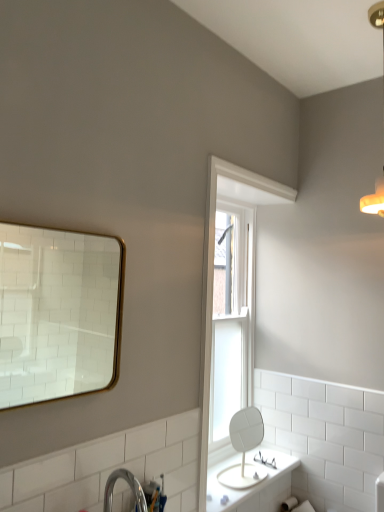
Question: Does white painted wood window frame at upper center lie behind gold-framed mirror at upper left, arranged as the 2th mirror when viewed from the right?

Choices:
 (A) yes
 (B) no

Answer: (A)

Question: From a real-world perspective, is white painted wood window frame at upper center physically above gold-framed mirror at upper left, the first mirror from the top?

Choices:
 (A) yes
 (B) no

Answer: (B)

Question: Considering the relative sizes of white painted wood window frame at upper center and gold-framed mirror at upper left, the 2th mirror positioned from the back, in the image provided, is white painted wood window frame at upper center bigger than gold-framed mirror at upper left, the 2th mirror positioned from the back,?

Choices:
 (A) no
 (B) yes

Answer: (B)

Question: From the image's perspective, does white painted wood window frame at upper center appear lower than gold-framed mirror at upper left, the first mirror from the top?

Choices:
 (A) yes
 (B) no

Answer: (A)

Question: Is white painted wood window frame at upper center not inside gold-framed mirror at upper left, the first mirror from the top?

Choices:
 (A) no
 (B) yes

Answer: (B)

Question: Does white painted wood window frame at upper center contain gold-framed mirror at upper left, the 2th mirror positioned from the back?

Choices:
 (A) yes
 (B) no

Answer: (B)

Question: From a real-world perspective, is white glossy mirror at center, the 1th mirror when ordered from back to front, beneath warm matte light fixture at upper right?

Choices:
 (A) no
 (B) yes

Answer: (B)

Question: Is white glossy mirror at center, the 2th mirror from the front, oriented away from warm matte light fixture at upper right?

Choices:
 (A) no
 (B) yes

Answer: (A)

Question: From the image's perspective, is white glossy mirror at center, acting as the first mirror starting from the right, above warm matte light fixture at upper right?

Choices:
 (A) yes
 (B) no

Answer: (B)

Question: Considering the relative positions of white glossy mirror at center, placed as the 1th mirror when sorted from bottom to top, and warm matte light fixture at upper right in the image provided, is white glossy mirror at center, placed as the 1th mirror when sorted from bottom to top, to the left of warm matte light fixture at upper right from the viewer's perspective?

Choices:
 (A) no
 (B) yes

Answer: (B)

Question: Is white glossy mirror at center, placed as the 1th mirror when sorted from bottom to top, positioned far away from warm matte light fixture at upper right?

Choices:
 (A) yes
 (B) no

Answer: (A)

Question: Is white glossy mirror at center, acting as the first mirror starting from the right, outside of warm matte light fixture at upper right?

Choices:
 (A) yes
 (B) no

Answer: (A)

Question: Is clear glass window at center taller than white painted wood window frame at upper center?

Choices:
 (A) yes
 (B) no

Answer: (B)